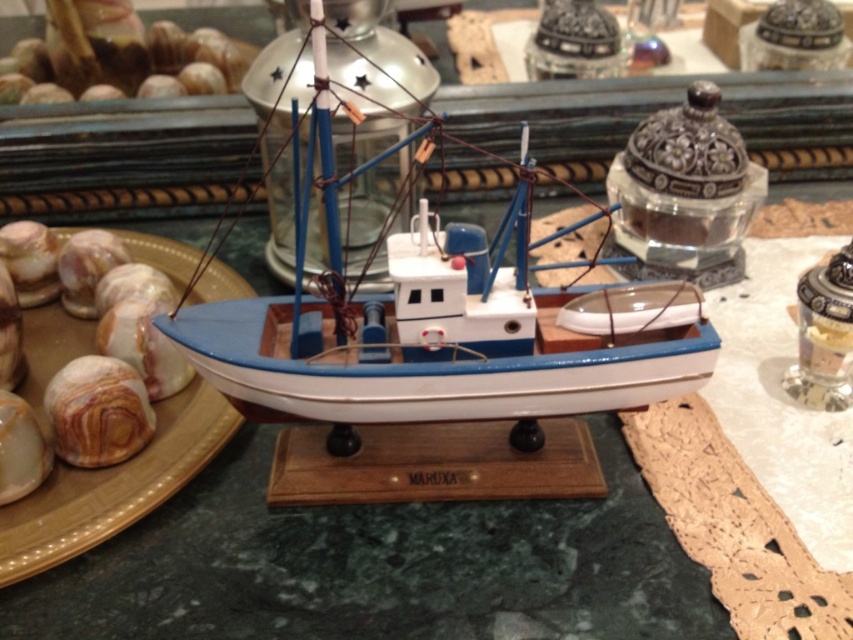
Which of these two, wooden boat at center or matte brown plate at left, stands taller?

With more height is matte brown plate at left.

Which is below, wooden boat at center or matte brown plate at left?

wooden boat at center is lower down.

Does point (115, 580) come in front of point (120, 499)?

Yes.

Image resolution: width=853 pixels, height=640 pixels. Find the location of `wooden boat at center`. wooden boat at center is located at coordinates (376, 566).

Measure the distance between matte blue wooden boat at center and camera.

A distance of 27.21 inches exists between matte blue wooden boat at center and camera.

Between point (601, 328) and point (36, 378), which one is positioned behind?

Point (36, 378)

Locate an element on the screen. The image size is (853, 640). matte blue wooden boat at center is located at coordinates (433, 355).

Between point (531, 488) and point (611, 573), which one is positioned behind?

The point (531, 488) is more distant.

Who is lower down, matte blue wooden boat at center or wooden boat at center?

A: wooden boat at center is lower down.

What do you see at coordinates (433, 355) in the screenshot? This screenshot has height=640, width=853. I see `matte blue wooden boat at center` at bounding box center [433, 355].

The height and width of the screenshot is (640, 853). What are the coordinates of `matte blue wooden boat at center` in the screenshot? It's located at (433, 355).